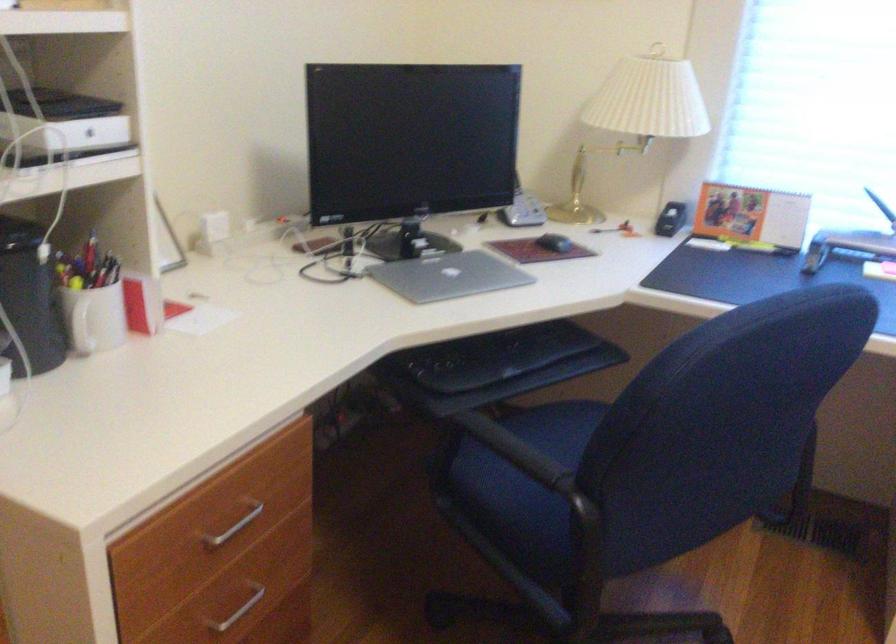
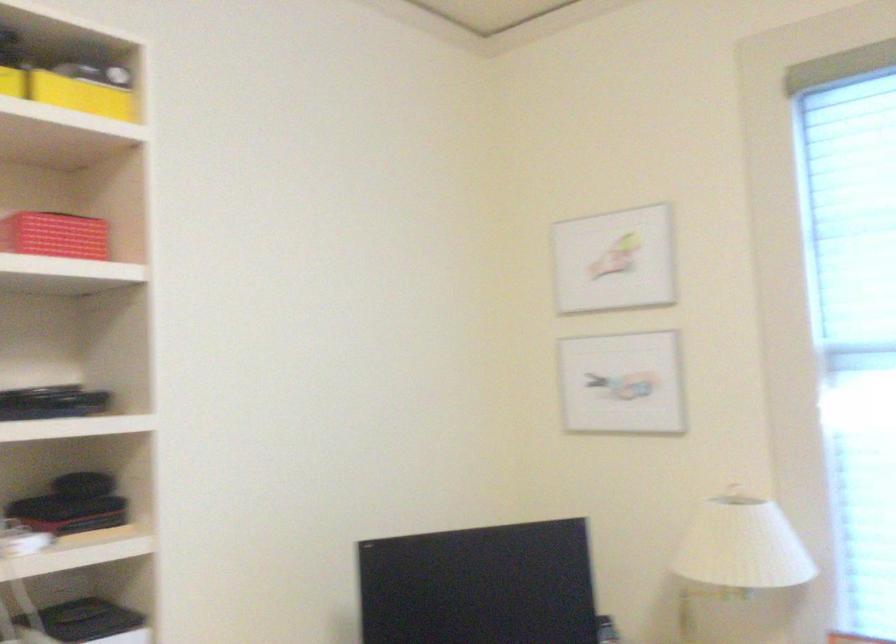
First-person continuous shooting, in which direction is the camera rotating?

The camera's rotation is toward left-up.